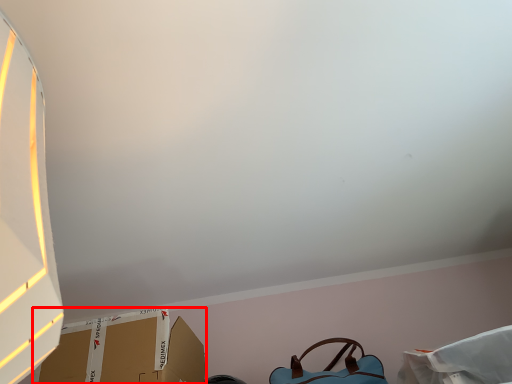
Question: Considering the relative positions of cardboard box (annotated by the red box) and handbag in the image provided, where is cardboard box (annotated by the red box) located with respect to the staircase?

Choices:
 (A) right
 (B) left

Answer: (B)